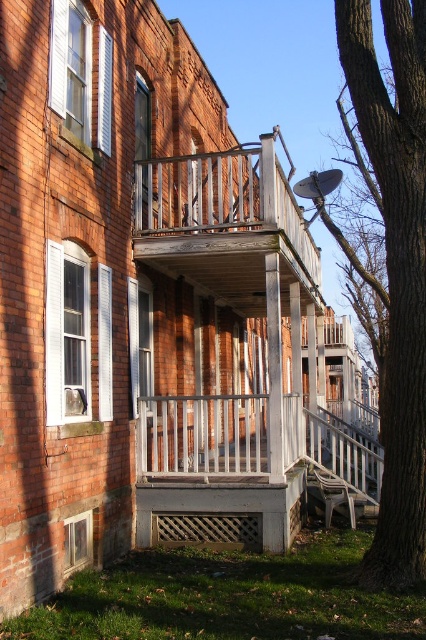
Can you confirm if brown rough bark tree at right is positioned to the right of white wooden balustrade at center?

Correct, you'll find brown rough bark tree at right to the right of white wooden balustrade at center.

Does point (417, 298) come farther from viewer compared to point (238, 456)?

No, it is not.

At what (x,y) coordinates should I click in order to perform the action: click on brown rough bark tree at right. Please return your answer as a coordinate pair (x, y). Looking at the image, I should click on (397, 264).

Who is taller, brown rough bark tree at right or weathered wood balcony at center?

weathered wood balcony at center is taller.

Who is more forward, (385,154) or (245,292)?

Positioned in front is point (385,154).

You are a GUI agent. You are given a task and a screenshot of the screen. Output one action in this format:
    pyautogui.click(x=<x>, y=<y>)
    Task: Click on the brown rough bark tree at right
    The image size is (426, 640).
    Given the screenshot: What is the action you would take?
    pyautogui.click(x=397, y=264)

Is point (143, 200) farther from camera compared to point (244, 401)?

Yes, it is behind point (244, 401).

Does weathered wood balcony at center come behind white wooden balustrade at center?

Yes.

This screenshot has height=640, width=426. Find the location of `weathered wood balcony at center`. weathered wood balcony at center is located at coordinates (224, 224).

Where is `weathered wood balcony at center`? The height and width of the screenshot is (640, 426). weathered wood balcony at center is located at coordinates (224, 224).